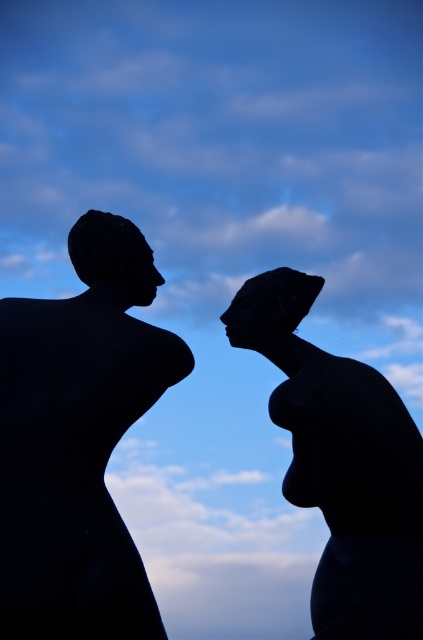
You are an art curator planning to install these sculptures in a gallery. You need to ensure that the black matte sculpture at center does not cast a shadow on the black matte sculpture at left during the day. Given the current arrangement, is this possible?

The black matte sculpture at center is positioned under the black matte sculpture at left, meaning it is directly below it. Depending on the angle and height difference, if the light source is above, the shadow of the upper sculpture would fall on the lower one. To prevent this, the sculptures should be arranged side by side or adjusted so the lower one is not directly beneath the other.

You are an art curator planning to display both the black matte sculpture at center and the silhouette stone head at center in a gallery. Given their sizes, which one should be placed closer to the entrance to ensure visitors notice both effectively?

The black matte sculpture at center is larger in size than the silhouette stone head at center, so placing the smaller silhouette stone head at center closer to the entrance will allow visitors to see it first and then move towards the larger sculpture further back, ensuring both are noticed effectively.

You are an art curator planning to rearrange the sculptures in the image. If you want to move the black matte sculpture at left to the right side of the black matte sculpture at center, will its new position be to the right or left of the original position?

The black matte sculpture at center is currently to the right of the black matte sculpture at left. If you move the black matte sculpture at left to the right side of the black matte sculpture at center, its new position will be to the right of its original position.